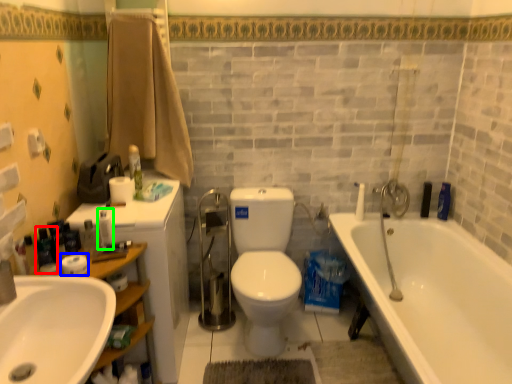
Question: Which object is the closest to the toiletry (highlighted by a red box)? Choose among these: toilet paper (highlighted by a blue box) or toiletry (highlighted by a green box).

Choices:
 (A) toilet paper
 (B) toiletry

Answer: (A)